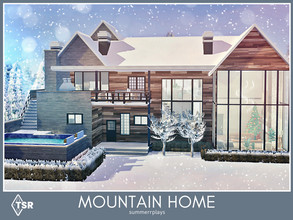
The width and height of the screenshot is (293, 220). Find the location of `christmas tree`. christmas tree is located at coordinates (254, 124).